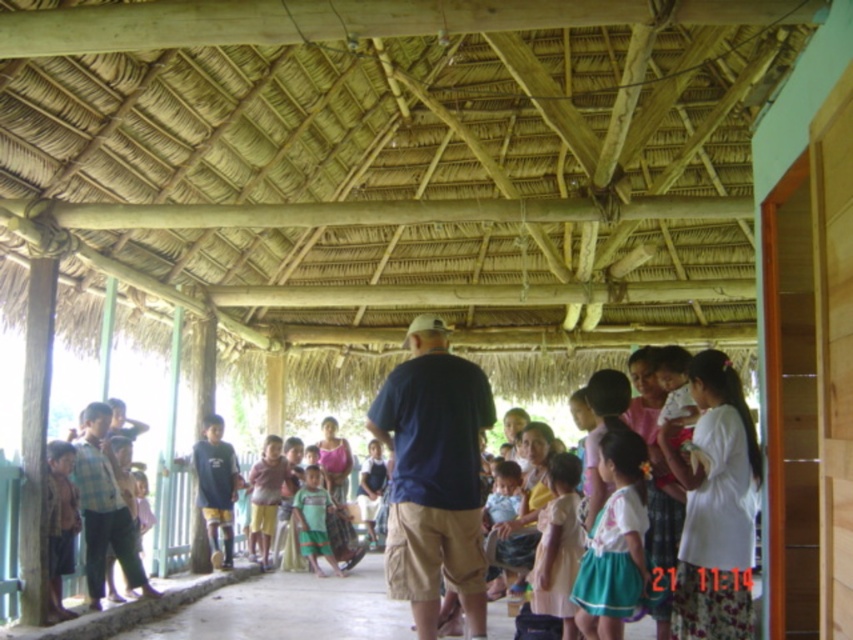
You are a photographer trying to capture a candid shot of the dark blue shirt at center and the brown woven skirt at lower left. Since you want both subjects in the frame, which direction should you move to ensure both are visible?

The dark blue shirt at center is to the right of the brown woven skirt at lower left. To include both in the frame, you should move to the left side so that you can capture both the dark blue shirt at center and the brown woven skirt at lower left in your shot.

You are a photographer trying to capture a candid shot of the dark blue shirt at center and the brown woven skirt at lower left. Since you want to focus on both subjects, which one should you position closer to the camera to ensure both are in focus without moving the subjects?

The dark blue shirt at center should be positioned closer to the camera because it is in front of the brown woven skirt at lower left, so keeping it closer ensures both are in focus without moving the subjects.

You are standing in the thatched roof structure and want to sit down on the light brown wooden chair at center. Is the green cotton shirt at center blocking your path to the chair?

The green cotton shirt at center is in front of the light brown wooden chair at center, so it is blocking your path to the chair.